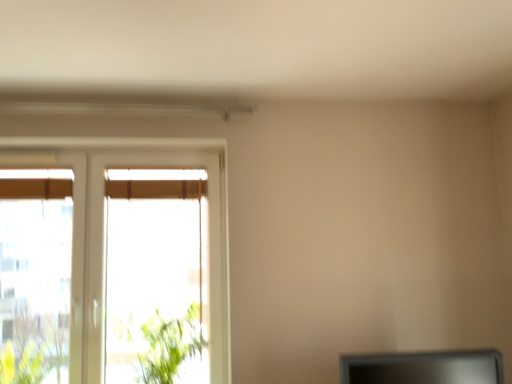
What is the approximate height of matte black monitor at lower right?

matte black monitor at lower right is 7.89 inches tall.

Identify the location of matte black monitor at lower right. (424, 368).

From the image's perspective, which one is positioned lower, green leafy plant at left or white plastic window at left?

From the image's view, green leafy plant at left is below.

Looking at this image, is green leafy plant at left inside the boundaries of white plastic window at left, or outside?

green leafy plant at left is located beyond the bounds of white plastic window at left.

The image size is (512, 384). Identify the location of plant that is under the white plastic window at left (from a real-world perspective). (164, 344).

Is green leafy plant at left bigger than white plastic window at left?

Actually, green leafy plant at left might be smaller than white plastic window at left.

From the image's perspective, which one is positioned higher, green leafy plant at left or matte black monitor at lower right?

matte black monitor at lower right.

Is green leafy plant at left turned away from matte black monitor at lower right?

No, green leafy plant at left is not facing away from matte black monitor at lower right.

Is green leafy plant at left smaller than matte black monitor at lower right?

Incorrect, green leafy plant at left is not smaller in size than matte black monitor at lower right.

Is green leafy plant at left shorter than matte black monitor at lower right?

In fact, green leafy plant at left may be taller than matte black monitor at lower right.

Does point (374, 379) come farther from viewer compared to point (156, 322)?

No, (374, 379) is in front of (156, 322).

Are matte black monitor at lower right and green leafy plant at left far apart?

No, matte black monitor at lower right is in close proximity to green leafy plant at left.

Can you confirm if matte black monitor at lower right is positioned to the left of green leafy plant at left?

No, matte black monitor at lower right is not to the left of green leafy plant at left.

Between matte black monitor at lower right and green leafy plant at left, which one has larger size?

Bigger between the two is green leafy plant at left.

Can you confirm if white plastic window at left is bigger than green leafy plant at left?

Yes, white plastic window at left is bigger than green leafy plant at left.

Is white plastic window at left positioned with its back to green leafy plant at left?

Yes.

How different are the orientations of white plastic window at left and green leafy plant at left in degrees?

white plastic window at left and green leafy plant at left are facing 0.455 degrees away from each other.

Locate an element on the screen. This screenshot has width=512, height=384. window above the green leafy plant at left (from the image's perspective) is located at coordinates (104, 245).

Locate an element on the screen. Image resolution: width=512 pixels, height=384 pixels. window located on the left of matte black monitor at lower right is located at coordinates (104, 245).

Is the surface of white plastic window at left in direct contact with matte black monitor at lower right?

No, white plastic window at left is not in contact with matte black monitor at lower right.

Does white plastic window at left have a greater width compared to matte black monitor at lower right?

No.

Which point is more forward, (418, 357) or (103, 162)?

Positioned in front is point (418, 357).

In order to click on computer monitor directly beneath the white plastic window at left (from a real-world perspective) in this screenshot , I will do `click(424, 368)`.

Considering the sizes of objects matte black monitor at lower right and white plastic window at left in the image provided, who is shorter, matte black monitor at lower right or white plastic window at left?

Standing shorter between the two is matte black monitor at lower right.

The width and height of the screenshot is (512, 384). Identify the location of window above the green leafy plant at left (from a real-world perspective). (104, 245).

Identify the location of plant that is behind the matte black monitor at lower right. (164, 344).

Based on their spatial positions, is matte black monitor at lower right or green leafy plant at left further from white plastic window at left?

Among the two, matte black monitor at lower right is located further to white plastic window at left.

Estimate the real-world distances between objects in this image. Which object is closer to green leafy plant at left, white plastic window at left or matte black monitor at lower right?

The object closer to green leafy plant at left is white plastic window at left.

Looking at this image, considering their positions, is green leafy plant at left positioned closer to white plastic window at left than matte black monitor at lower right?

Among the two, green leafy plant at left is located nearer to white plastic window at left.

Estimate the real-world distances between objects in this image. Which object is further from matte black monitor at lower right, white plastic window at left or green leafy plant at left?

white plastic window at left is positioned further to the anchor matte black monitor at lower right.

From the image, which object appears to be nearer to green leafy plant at left, matte black monitor at lower right or white plastic window at left?

Among the two, white plastic window at left is located nearer to green leafy plant at left.

Looking at the image, which one is located closer to matte black monitor at lower right, green leafy plant at left or white plastic window at left?

Among the two, green leafy plant at left is located nearer to matte black monitor at lower right.

Image resolution: width=512 pixels, height=384 pixels. I want to click on plant between white plastic window at left and matte black monitor at lower right in the horizontal direction, so coord(164,344).